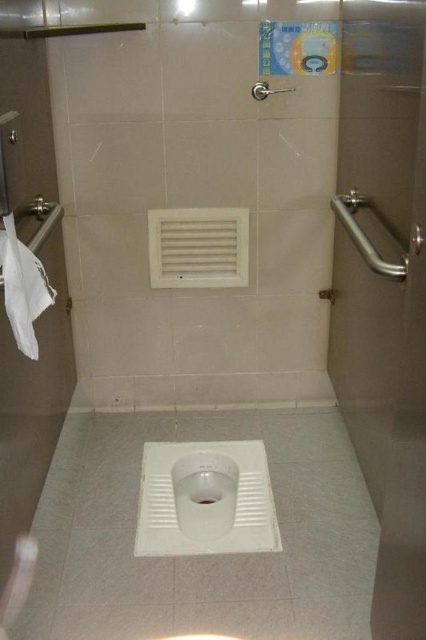
Question: Considering the relative positions of white glossy toilet bowl at center and satin nickel shower handle at upper center in the image provided, where is white glossy toilet bowl at center located with respect to satin nickel shower handle at upper center?

Choices:
 (A) below
 (B) above

Answer: (A)

Question: Estimate the real-world distances between objects in this image. Which object is closer to the white glossy toilet bowl at center?

Choices:
 (A) satin nickel shower handle at upper center
 (B) white fabric at left

Answer: (B)

Question: Can you confirm if satin nickel shower handle at upper center is positioned to the right of white glossy drain at center?

Choices:
 (A) no
 (B) yes

Answer: (B)

Question: Is white glossy toilet bowl at center bigger than satin nickel shower handle at upper center?

Choices:
 (A) yes
 (B) no

Answer: (A)

Question: Which point is farther to the camera?

Choices:
 (A) tap(36, 284)
 (B) tap(209, 515)
 (C) tap(204, 499)

Answer: (C)

Question: Which point appears closest to the camera in this image?

Choices:
 (A) (215, 499)
 (B) (29, 262)

Answer: (B)